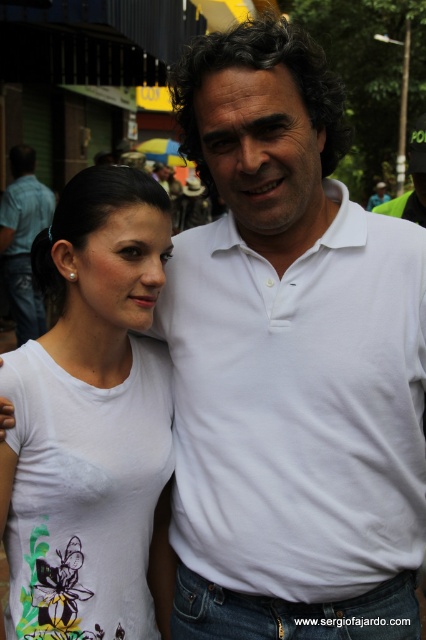
You are organizing a clothing store and need to arrange two shirts on a mannequin. The shirts are the white cotton shirt at center and the matte white shirt at center. According to their positions in the image, which shirt should be placed on the right side of the mannequin?

The white cotton shirt at center should be placed on the right side of the mannequin because it is positioned on the right side of the matte white shirt at center in the image.

You are standing at point (342, 224) and want to toss a small ball to a friend who is standing 3 meters away from you. Can you reach your friend with the ball?

The distance between you and your friend is 2.19 meters, so yes, you can reach your friend with the ball since it is within the 3 meters range.